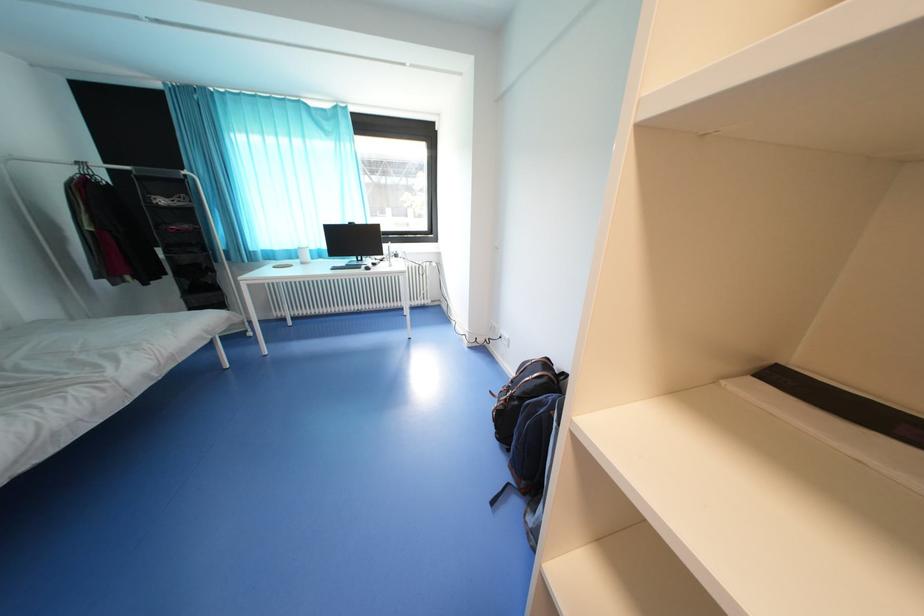
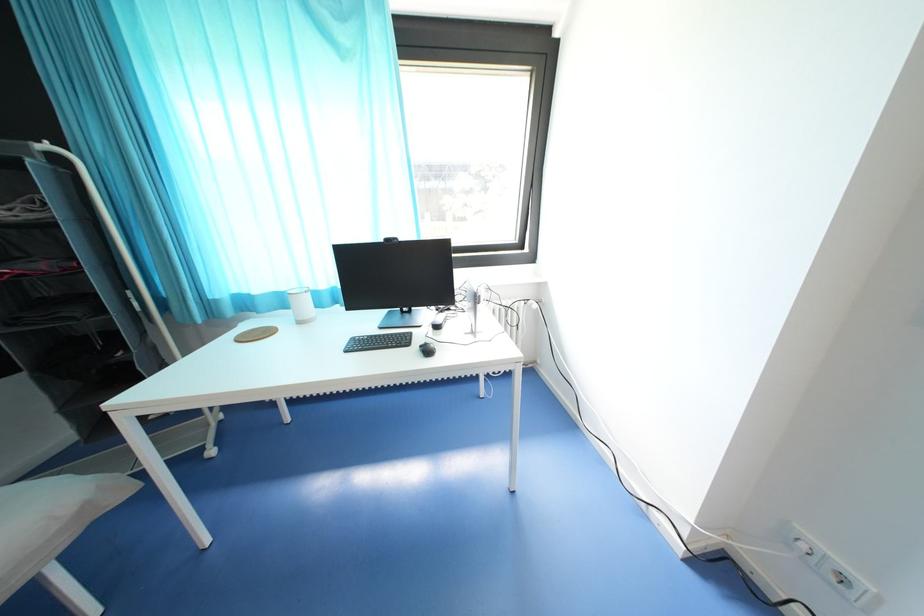
What movement of the cameraman would produce the second image?

The cameraman moved toward left, forward.